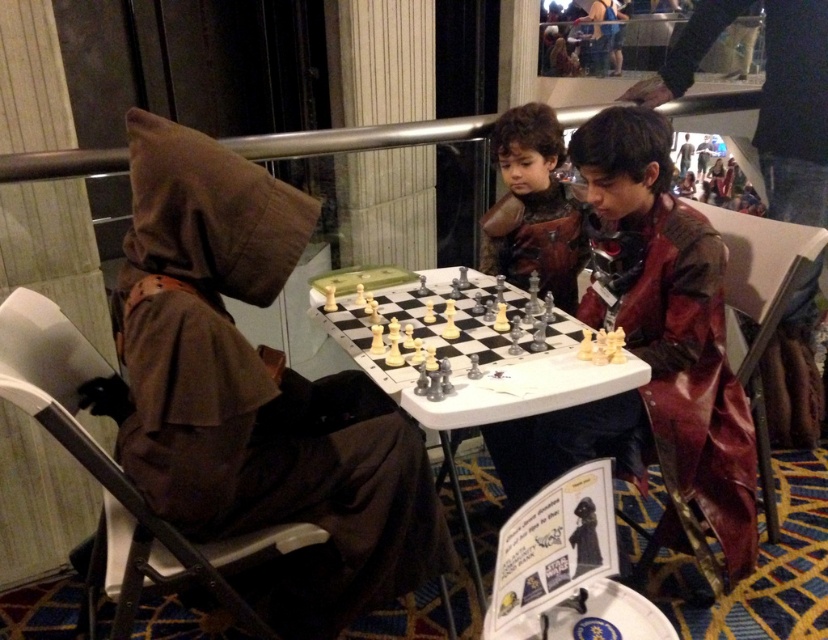
You are a photographer at the Star Wars themed chess tournament. You need to capture a photo where both the brown fabric hood at upper left and the metallic chess set at center are visible. Since the camera can only focus on one object at a time, which object should you focus on to ensure the other remains in the frame?

You should focus on the metallic chess set at center because the brown fabric hood at upper left is positioned on the left side of it, ensuring both will be in the frame when the chess set is centered.

You are a photographer at the Star Wars themed chess event. You need to position a spotlight such that it illuminates both the point at the chessboard labeled as point 1 at point [520,260] and point 2 at [369,333]. Given that the spotlight can only be placed at a position closer to the camera than both points, can you place it appropriately?

Point 1 at point [520,260] is further to the camera than point 2 at [369,333]. Therefore, the spotlight must be placed between the camera and point 2 to illuminate both points, but since the spotlight needs to be closer to the camera than both points, it cannot reach point 1 which is further away. Thus, it is not possible to place the spotlight appropriately.

You are a photographer at the Star Wars themed chess event. You need to place a small prop on the chessboard so that it is directly in front of the brown fabric hood at upper left. Where should you place the prop on the chessboard?

Place the prop at the square corresponding to the coordinates where the brown fabric hood at upper left is located, which is at point (256,394). Since the hood is at upper left, the prop should be placed on the lower right side of the chessboard to be in front of it from the photographer perspective.